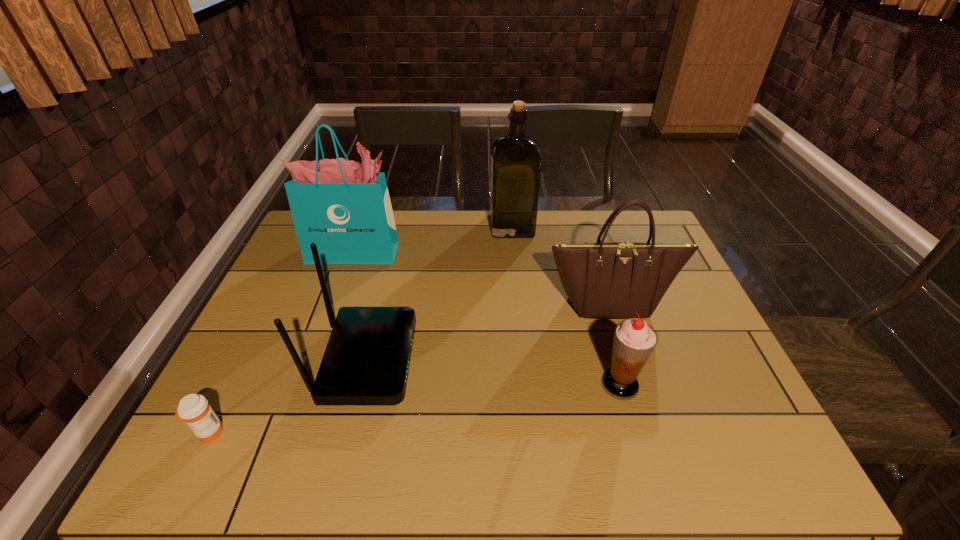
Image resolution: width=960 pixels, height=540 pixels. In order to click on vacant area that satisfies the following two spatial constraints: 1. on the back side of the smoothie; 2. on the front-facing side of the third shortest object in this screenshot , I will do `click(613, 360)`.

Locate an element on the screen. This screenshot has height=540, width=960. vacant point that satisfies the following two spatial constraints: 1. on the front-facing side of the router; 2. on the right side of the smoothie is located at coordinates (361, 384).

The height and width of the screenshot is (540, 960). What are the coordinates of `blank space that satisfies the following two spatial constraints: 1. on the front-facing side of the fourth tallest object; 2. on the front side of the nearest object` in the screenshot? It's located at (349, 434).

I want to click on vacant space that satisfies the following two spatial constraints: 1. on the label of the farthest object; 2. on the left side of the second shortest object, so click(527, 384).

You are a GUI agent. You are given a task and a screenshot of the screen. Output one action in this format:
    pyautogui.click(x=<x>, y=<y>)
    Task: Click on the vacant space that satisfies the following two spatial constraints: 1. on the label of the farthest object; 2. on the right side of the fifth tallest object
    
    Given the screenshot: What is the action you would take?
    pyautogui.click(x=527, y=384)

Where is `vacant area that satisfies the following two spatial constraints: 1. on the label of the liquor; 2. on the front side of the fifth nearest object`? This screenshot has width=960, height=540. vacant area that satisfies the following two spatial constraints: 1. on the label of the liquor; 2. on the front side of the fifth nearest object is located at coordinates (515, 252).